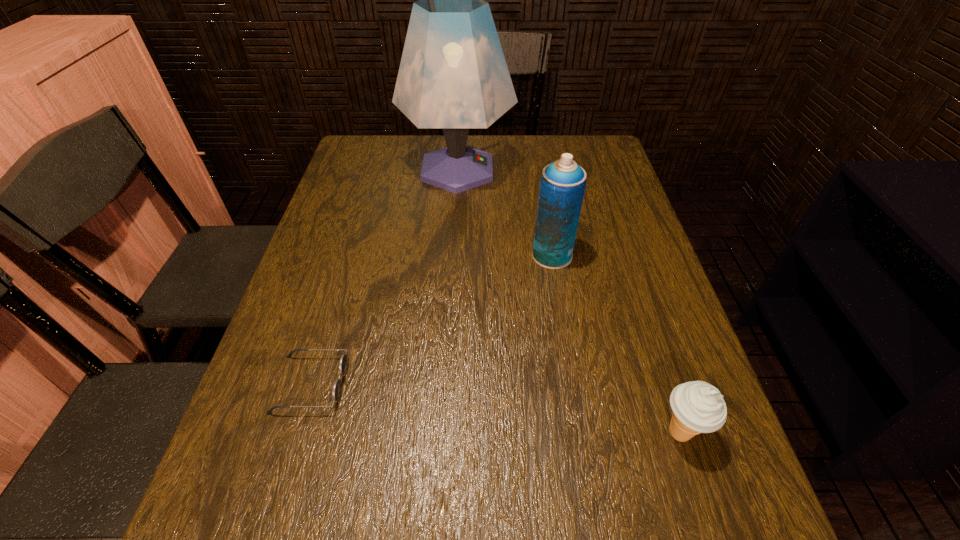
Select which object appears as the closest to the shortest object. Please provide its 2D coordinates. Your answer should be formatted as a tuple, i.e. [(x, y)], where the tuple contains the x and y coordinates of a point satisfying the conditions above.

[(562, 185)]

Find the location of a particular element. The image size is (960, 540). object that ranks as the third closest to the third tallest object is located at coordinates (453, 75).

Image resolution: width=960 pixels, height=540 pixels. I want to click on vacant position in the image that satisfies the following two spatial constraints: 1. on the base of the lampshade; 2. on the left side of the aerosol can, so click(452, 255).

Locate an element on the screen. The width and height of the screenshot is (960, 540). free space in the image that satisfies the following two spatial constraints: 1. on the base of the third shortest object; 2. on the right side of the tallest object is located at coordinates (452, 255).

This screenshot has height=540, width=960. I want to click on free region that satisfies the following two spatial constraints: 1. on the front side of the aerosol can; 2. on the left side of the second shortest object, so click(581, 433).

This screenshot has width=960, height=540. I want to click on vacant region that satisfies the following two spatial constraints: 1. on the front side of the second tallest object; 2. on the front-facing side of the shortest object, so click(x=573, y=384).

Find the location of `free space that satisfies the following two spatial constraints: 1. on the front-facing side of the sunglasses; 2. on the right side of the rightmost object`. free space that satisfies the following two spatial constraints: 1. on the front-facing side of the sunglasses; 2. on the right side of the rightmost object is located at coordinates (297, 433).

Where is `vacant area in the image that satisfies the following two spatial constraints: 1. on the front-facing side of the shortest object; 2. on the back side of the rightmost object`? vacant area in the image that satisfies the following two spatial constraints: 1. on the front-facing side of the shortest object; 2. on the back side of the rightmost object is located at coordinates coord(297,433).

This screenshot has width=960, height=540. Identify the location of vacant point that satisfies the following two spatial constraints: 1. on the back side of the third shortest object; 2. on the base of the farthest object. pos(538,170).

This screenshot has width=960, height=540. I want to click on vacant region that satisfies the following two spatial constraints: 1. on the base of the farthest object; 2. on the right side of the aerosol can, so click(x=452, y=255).